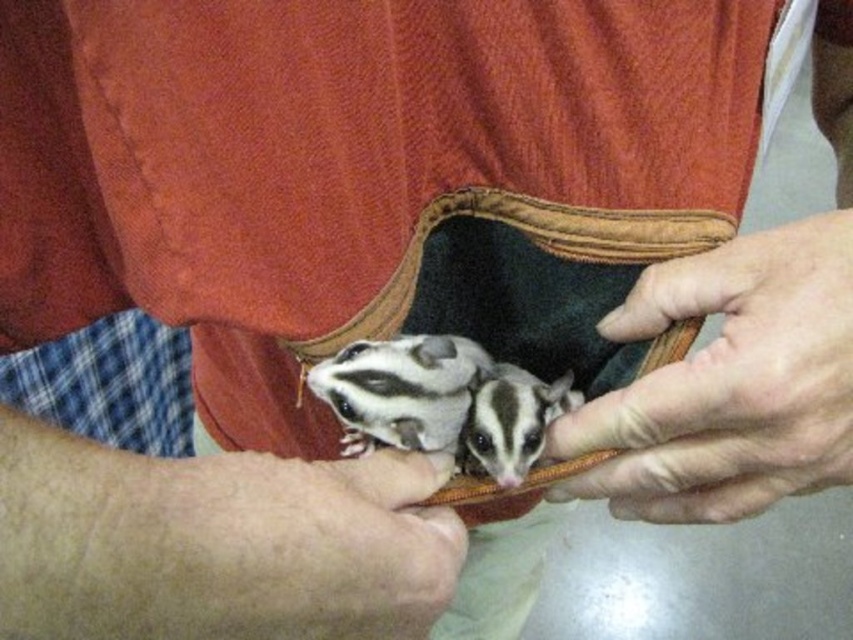
You are a zookeeper observing two sugar gliders in a pouch. You notice the black and white fur at center and the white fur with black stripes at center. Which one is bigger?

The black and white fur at center is larger in size than the white fur with black stripes at center.